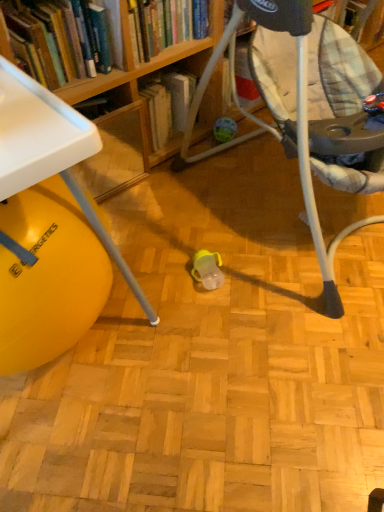
The width and height of the screenshot is (384, 512). Identify the location of blank area beneath matte plastic baby swing at center (from a real-world perspective). (283, 206).